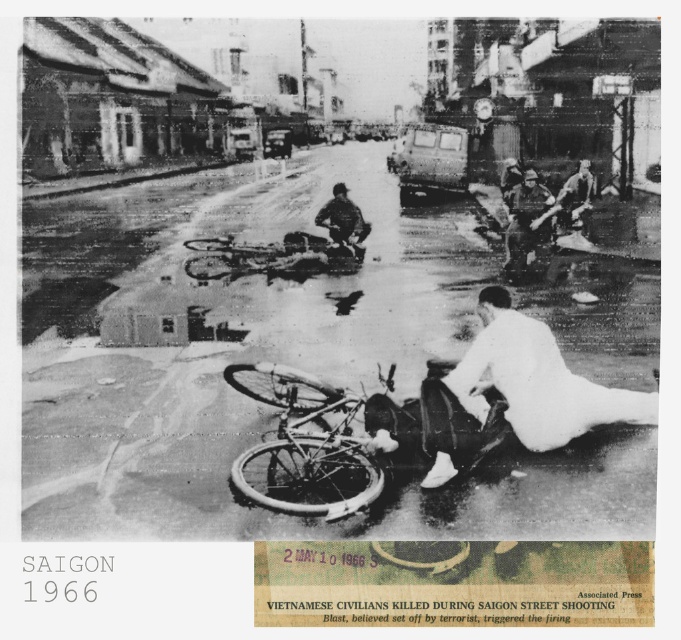
Is white matte bicycle at center further to the viewer compared to white rubber tire at center?

Yes, white matte bicycle at center is further from the viewer.

Can you confirm if white matte bicycle at center is taller than white rubber tire at center?

Yes, white matte bicycle at center is taller than white rubber tire at center.

Describe the element at coordinates (304, 445) in the screenshot. The height and width of the screenshot is (640, 681). I see `white matte bicycle at center` at that location.

Identify the location of white matte bicycle at center. (304, 445).

Does white matte bicycle at center have a lesser width compared to camouflage fabric uniform at center?

No, white matte bicycle at center is not thinner than camouflage fabric uniform at center.

Is white matte bicycle at center behind camouflage fabric uniform at center?

No, white matte bicycle at center is in front of camouflage fabric uniform at center.

The image size is (681, 640). I want to click on white matte bicycle at center, so click(304, 445).

Is point (648, 420) positioned in front of point (358, 241)?

Yes.

Is point (488, 385) positioned after point (336, 182)?

No, (488, 385) is closer to viewer.

You are a GUI agent. You are given a task and a screenshot of the screen. Output one action in this format:
    pyautogui.click(x=<x>, y=<y>)
    Task: Click on the white matte shirt at lower right
    This screenshot has width=681, height=640.
    Given the screenshot: What is the action you would take?
    pyautogui.click(x=537, y=380)

Where is `white matte shirt at lower right`? This screenshot has width=681, height=640. white matte shirt at lower right is located at coordinates (537, 380).